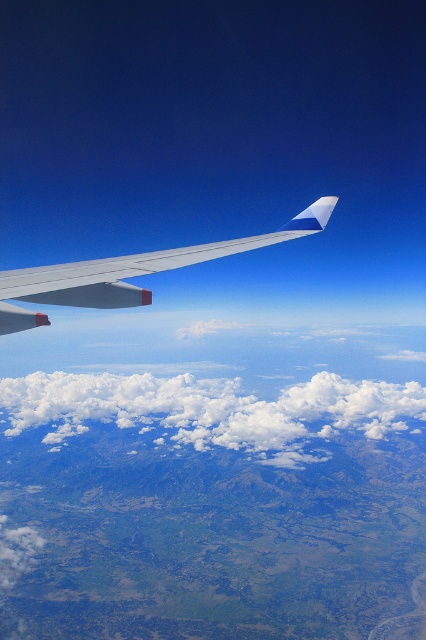
You are a passenger on an airplane and looking out the window. You see a white fluffy cloud at center and a silver metallic wing at upper center. Which object is closer to the left side of your view?

The white fluffy cloud at center is positioned on the left side of the silver metallic wing at upper center, so it is closer to the left side of your view.

Based on the photo, you are a passenger sitting by the window and looking outside. You see the white fluffy cloud at center and the silver metallic wing at upper center. Which object is closer to you?

The white fluffy cloud at center is positioned under the silver metallic wing at upper center, so the silver metallic wing at upper center is closer to you.